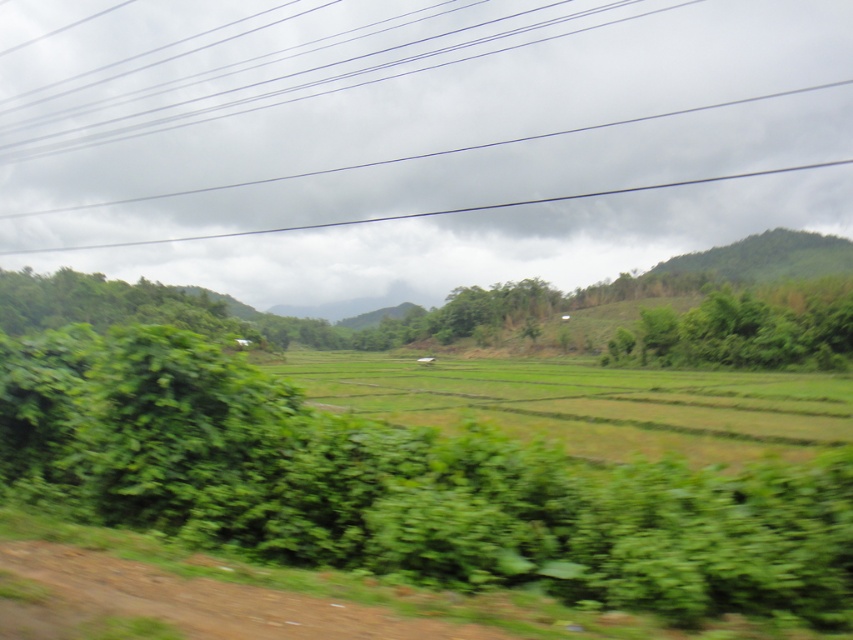
Which is below, black wire at upper center or green leafy tree at right?

green leafy tree at right

Does point (660, 212) come closer to viewer compared to point (735, 317)?

That is False.

Where is `black wire at upper center`? The width and height of the screenshot is (853, 640). black wire at upper center is located at coordinates (393, 106).

Does green grassy field at center appear under green leafy tree at right?

Yes, green grassy field at center is below green leafy tree at right.

Is green grassy field at center positioned behind green leafy tree at right?

No, green grassy field at center is in front of green leafy tree at right.

Does point (267, 369) come farther from viewer compared to point (672, 310)?

No, (267, 369) is in front of (672, 310).

The height and width of the screenshot is (640, 853). What are the coordinates of `green grassy field at center` in the screenshot? It's located at (590, 403).

Does black wire at upper center appear on the left side of green grassy field at center?

Correct, you'll find black wire at upper center to the left of green grassy field at center.

Who is taller, black wire at upper center or green grassy field at center?

With more height is black wire at upper center.

At what (x,y) coordinates should I click in order to perform the action: click on black wire at upper center. Please return your answer as a coordinate pair (x, y). Looking at the image, I should click on (393, 106).